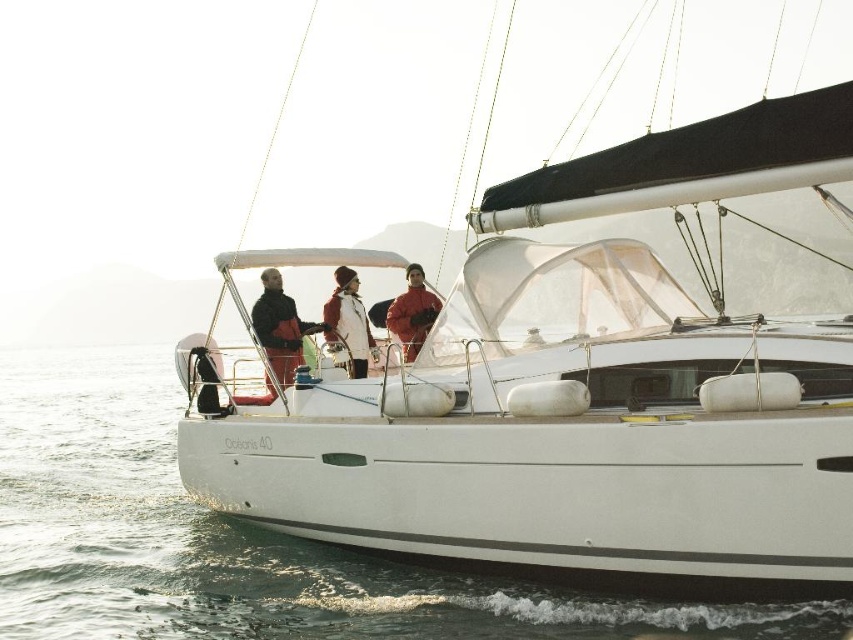
Question: Is matte black jacket at center bigger than white woolen hat at center?

Choices:
 (A) yes
 (B) no

Answer: (B)

Question: Which object appears closest to the camera in this image?

Choices:
 (A) white matte sailboat at center
 (B) clear water at lower left

Answer: (A)

Question: Observing the image, what is the correct spatial positioning of white matte sailboat at center in reference to clear water at lower left?

Choices:
 (A) below
 (B) above

Answer: (B)

Question: Which point appears closest to the camera in this image?

Choices:
 (A) (360, 342)
 (B) (195, 529)
 (C) (424, 312)
 (D) (277, 337)

Answer: (D)

Question: Is white woolen hat at center to the right of matte red jacket at center from the viewer's perspective?

Choices:
 (A) no
 (B) yes

Answer: (A)

Question: Among these points, which one is nearest to the camera?

Choices:
 (A) (340, 320)
 (B) (363, 570)

Answer: (B)